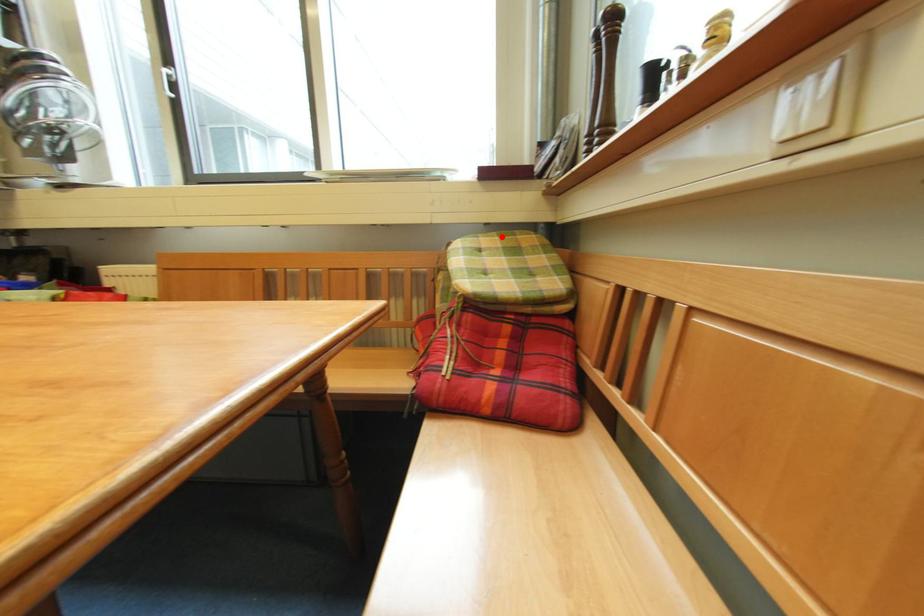
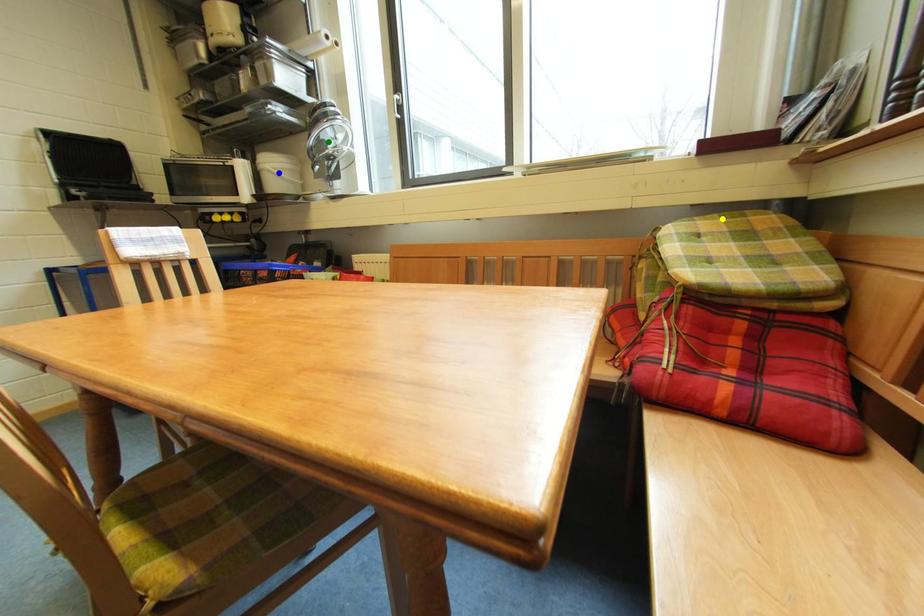
Question: I am providing you with two images of the same scene from different viewpoints. A red point is marked on the first image. You are given multiple points on the second image. Can you choose the point in image 2 that corresponds to the point in image 1?

Choices:
 (A) blue point
 (B) yellow point
 (C) green point

Answer: (B)